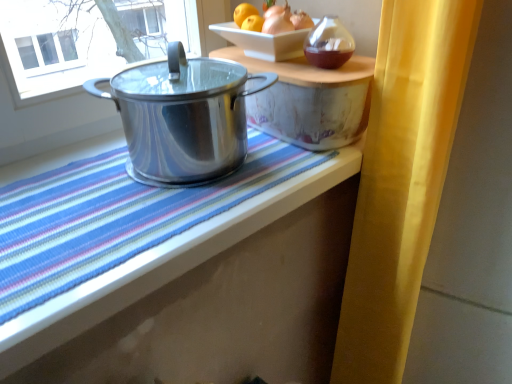
In order to click on free space on the front side of shiny metallic pot at left in this screenshot , I will do `click(143, 218)`.